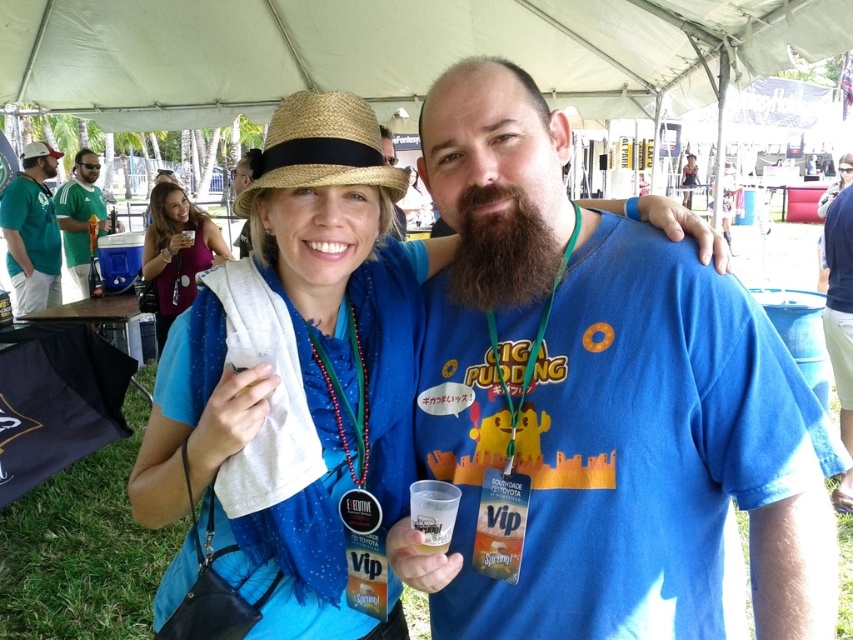
Is blue fabric dress at center thinner than green jersey at left?

Correct, blue fabric dress at center's width is less than green jersey at left's.

At what (x,y) coordinates should I click in order to perform the action: click on blue fabric dress at center. Please return your answer as a coordinate pair (x, y). Looking at the image, I should click on (334, 346).

Who is more forward, (357,304) or (84,236)?

Point (357,304) is in front.

Where is `blue fabric dress at center`? The image size is (853, 640). blue fabric dress at center is located at coordinates (334, 346).

Is dark brown thick beard at center in front of matte black tank top at upper center?

Yes, it is in front of matte black tank top at upper center.

Is point (474, 241) more distant than point (685, 177)?

No, it is not.

Identify the location of dark brown thick beard at center. (502, 252).

In order to click on dark brown thick beard at center in this screenshot , I will do click(502, 252).

Is blue cotton shirt at center in front of blue fabric dress at center?

That is True.

Which of these two, blue cotton shirt at center or blue fabric dress at center, stands taller?

With more height is blue fabric dress at center.

Is point (647, 381) farther from camera compared to point (358, 397)?

No, it is in front of (358, 397).

Locate an element on the screen. blue cotton shirt at center is located at coordinates (601, 403).